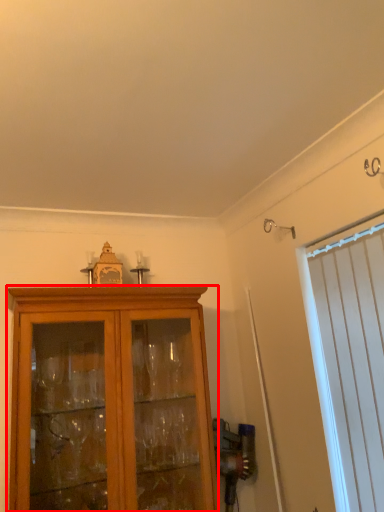
Question: Observing the image, what is the correct spatial positioning of cabinetry (annotated by the red box) in reference to curtain?

Choices:
 (A) right
 (B) left

Answer: (B)